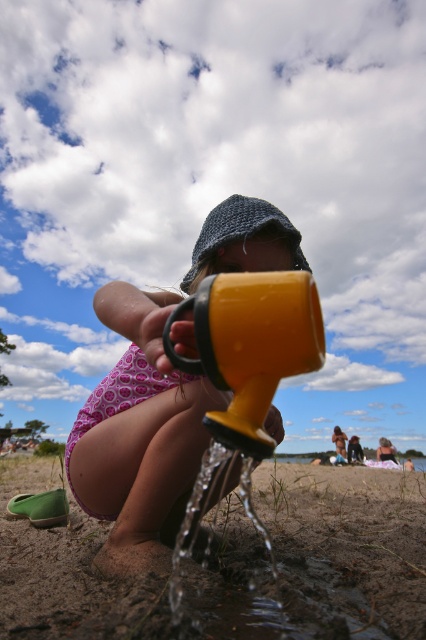
Question: Which of the following is the farthest from the observer?

Choices:
 (A) (356, 552)
 (B) (271, 321)
 (C) (276, 268)

Answer: (A)

Question: Which object appears closest to the camera in this image?

Choices:
 (A) transparent plastic water at lower center
 (B) yellow plastic cup at center
 (C) yellow matte watering can at center

Answer: (B)

Question: Which point is farther to the camera?

Choices:
 (A) transparent plastic water at lower center
 (B) yellow matte watering can at center

Answer: (A)

Question: Does transparent plastic water at lower center have a greater width compared to yellow plastic cup at center?

Choices:
 (A) yes
 (B) no

Answer: (A)

Question: Where is yellow matte watering can at center located in relation to yellow plastic cup at center in the image?

Choices:
 (A) right
 (B) left

Answer: (B)

Question: Is transparent plastic water at lower center bigger than yellow plastic cup at center?

Choices:
 (A) yes
 (B) no

Answer: (A)